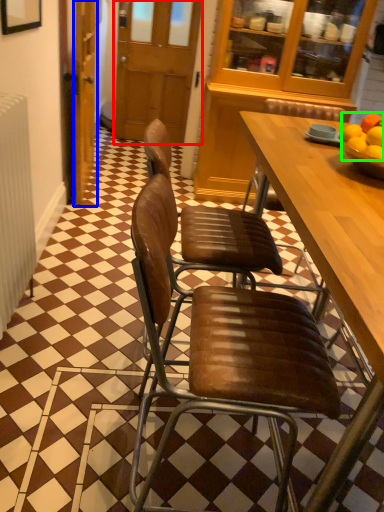
Question: Estimate the real-world distances between objects in this image. Which object is closer to glass door (highlighted by a red box), door (highlighted by a blue box) or fruit (highlighted by a green box)?

Choices:
 (A) door
 (B) fruit

Answer: (A)